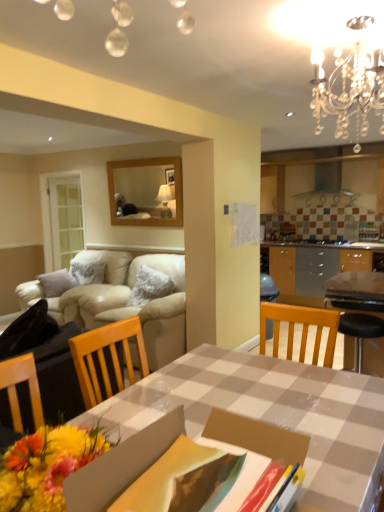
Question: Could you tell me if beige leather couch at left is turned towards checkerboard plastic table at center?

Choices:
 (A) yes
 (B) no

Answer: (B)

Question: From the image's perspective, is beige leather couch at left below checkerboard plastic table at center?

Choices:
 (A) no
 (B) yes

Answer: (A)

Question: Is beige leather couch at left far from checkerboard plastic table at center?

Choices:
 (A) no
 (B) yes

Answer: (B)

Question: Considering the relative positions of beige leather couch at left and checkerboard plastic table at center in the image provided, is beige leather couch at left to the right of checkerboard plastic table at center from the viewer's perspective?

Choices:
 (A) yes
 (B) no

Answer: (B)

Question: From the image's perspective, is beige leather couch at left above checkerboard plastic table at center?

Choices:
 (A) no
 (B) yes

Answer: (B)

Question: Looking at their shapes, would you say crystal chandelier at upper right is wider or thinner than checkerboard plastic table at center?

Choices:
 (A) thin
 (B) wide

Answer: (A)

Question: Is crystal chandelier at upper right bigger or smaller than checkerboard plastic table at center?

Choices:
 (A) big
 (B) small

Answer: (B)

Question: Do you think crystal chandelier at upper right is within checkerboard plastic table at center, or outside of it?

Choices:
 (A) outside
 (B) inside

Answer: (A)

Question: Is crystal chandelier at upper right in front of or behind checkerboard plastic table at center in the image?

Choices:
 (A) behind
 (B) front

Answer: (B)

Question: From their relative heights in the image, would you say checkered fabric table at center is taller or shorter than beige leather couch at left?

Choices:
 (A) short
 (B) tall

Answer: (A)

Question: Is point (291, 408) closer or farther from the camera than point (89, 309)?

Choices:
 (A) closer
 (B) farther

Answer: (A)

Question: Is checkered fabric table at center inside the boundaries of beige leather couch at left, or outside?

Choices:
 (A) inside
 (B) outside

Answer: (B)

Question: From the image's perspective, relative to beige leather couch at left, is checkered fabric table at center above or below?

Choices:
 (A) above
 (B) below

Answer: (B)

Question: From a real-world perspective, is checkerboard plastic table at center positioned above or below beige leather couch at left?

Choices:
 (A) below
 (B) above

Answer: (B)

Question: From the image's perspective, relative to beige leather couch at left, is checkerboard plastic table at center above or below?

Choices:
 (A) below
 (B) above

Answer: (A)